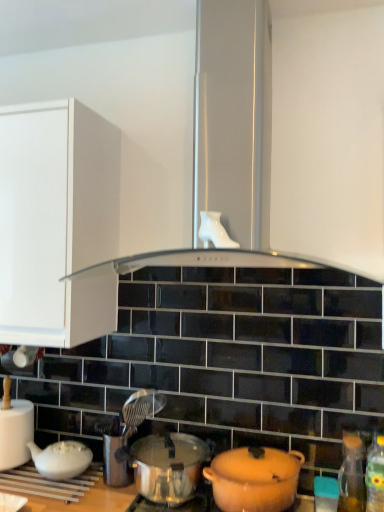
This screenshot has width=384, height=512. I want to click on black glass exhaust hood at center, so click(329, 138).

Where is `white matte teapot at lower left`? white matte teapot at lower left is located at coordinates (15, 433).

Where is `transparent glass bottle at lower right, which is counted as the first bottle, starting from the back`? transparent glass bottle at lower right, which is counted as the first bottle, starting from the back is located at coordinates (351, 476).

Find the location of a particular element. Image resolution: width=384 pixels, height=512 pixels. teal plastic container at lower right is located at coordinates (326, 494).

Identify the location of bottle beneath the green plastic bottle at lower right, which is the first bottle in front-to-back order (from a real-world perspective). The image size is (384, 512). (351, 476).

In the scene shown: Is transparent glass bottle at lower right, which ranks as the 2th bottle in front-to-back order, positioned in front of green plastic bottle at lower right, which is the first bottle in front-to-back order?

No, transparent glass bottle at lower right, which ranks as the 2th bottle in front-to-back order, is further to the viewer.

Can you confirm if transparent glass bottle at lower right, which is counted as the first bottle, starting from the back, is smaller than green plastic bottle at lower right, the second bottle positioned from the back?

Yes, transparent glass bottle at lower right, which is counted as the first bottle, starting from the back, is smaller than green plastic bottle at lower right, the second bottle positioned from the back.

From a real-world perspective, relative to teal plastic container at lower right, is matte orange pot at lower center, positioned as the 2th pot/pan in left-to-right order, vertically above or below?

matte orange pot at lower center, positioned as the 2th pot/pan in left-to-right order, is above teal plastic container at lower right.

Could you tell me if matte orange pot at lower center, positioned as the 2th pot/pan in left-to-right order, is turned towards teal plastic container at lower right?

No, matte orange pot at lower center, positioned as the 2th pot/pan in left-to-right order, is not oriented towards teal plastic container at lower right.

Between point (245, 452) and point (317, 494), which one is positioned in front?

Point (317, 494)

Starting from the teal plastic container at lower right, which pot/pan is the 2nd one in front? Please provide its 2D coordinates.

[(254, 479)]

Locate an element on the screen. The width and height of the screenshot is (384, 512). exhaust hood on the left of teal plastic container at lower right is located at coordinates (329, 138).

Is black glass exhaust hood at center in front of teal plastic container at lower right?

Yes, it is in front of teal plastic container at lower right.

How many degrees apart are the facing directions of black glass exhaust hood at center and teal plastic container at lower right?

2.85 degrees separate the facing orientations of black glass exhaust hood at center and teal plastic container at lower right.

How distant is green plastic bottle at lower right, the second bottle positioned from the back, from white matte teapot at lower left?

The distance of green plastic bottle at lower right, the second bottle positioned from the back, from white matte teapot at lower left is 1.23 meters.

Would you say white matte teapot at lower left is part of green plastic bottle at lower right, which is the first bottle in front-to-back order,'s contents?

Actually, white matte teapot at lower left is outside green plastic bottle at lower right, which is the first bottle in front-to-back order.

Are green plastic bottle at lower right, the second bottle positioned from the back, and white matte teapot at lower left making contact?

green plastic bottle at lower right, the second bottle positioned from the back, is not next to white matte teapot at lower left, and they're not touching.

Based on their sizes in the image, would you say green plastic bottle at lower right, the second bottle positioned from the back, is bigger or smaller than white matte teapot at lower left?

green plastic bottle at lower right, the second bottle positioned from the back, is smaller than white matte teapot at lower left.

Does point (272, 465) lie in front of point (278, 237)?

Yes, it is.

From the picture: From the image's perspective, would you say matte orange pot at lower center, which appears as the first pot/pan when viewed from the right, is shown under black glass exhaust hood at center?

Yes, from the image's perspective, matte orange pot at lower center, which appears as the first pot/pan when viewed from the right, is beneath black glass exhaust hood at center.

Does matte orange pot at lower center, positioned as the 2th pot/pan in left-to-right order, appear on the left side of black glass exhaust hood at center?

No, matte orange pot at lower center, positioned as the 2th pot/pan in left-to-right order, is not to the left of black glass exhaust hood at center.

Is matte orange pot at lower center, which appears as the first pot/pan when viewed from the right, located outside black glass exhaust hood at center?

That's correct, matte orange pot at lower center, which appears as the first pot/pan when viewed from the right, is outside of black glass exhaust hood at center.

From a real-world perspective, which object rests below the other?

In real-world perspective, white matte teapot at lower left is lower.

From the image's perspective, between white matte teapot at lower left and black glass exhaust hood at center, who is located below?

white matte teapot at lower left, from the image's perspective.

You are a GUI agent. You are given a task and a screenshot of the screen. Output one action in this format:
    pyautogui.click(x=<x>, y=<y>)
    Task: Click on the exhaust hood above the white matte teapot at lower left (from the image's perspective)
    
    Given the screenshot: What is the action you would take?
    pyautogui.click(x=329, y=138)

Can you confirm if white matte teapot at lower left is positioned to the right of black glass exhaust hood at center?

No, white matte teapot at lower left is not to the right of black glass exhaust hood at center.

Can you confirm if black glass exhaust hood at center is smaller than white matte teapot at lower left?

No, black glass exhaust hood at center is not smaller than white matte teapot at lower left.

Is point (294, 33) farther from viewer compared to point (9, 461)?

No, (294, 33) is closer to viewer.

Where is `exhaust hood that is on the right side of white matte teapot at lower left`? exhaust hood that is on the right side of white matte teapot at lower left is located at coordinates (329, 138).

Is black glass exhaust hood at center positioned in front of white matte teapot at lower left?

Yes.

What are the coordinates of `bottle that appears in front of the transparent glass bottle at lower right, which is counted as the first bottle, starting from the back` in the screenshot? It's located at (375, 476).

This screenshot has height=512, width=384. What are the coordinates of `appliance that appears on the right of matte orange pot at lower center, which appears as the first pot/pan when viewed from the right` in the screenshot? It's located at (326, 494).

In the scene shown: When comparing their distances from matte orange pot at lower center, which appears as the first pot/pan when viewed from the right, does transparent glass bottle at lower right, which ranks as the 2th bottle in front-to-back order, or black glass exhaust hood at center seem further?

The object further to matte orange pot at lower center, which appears as the first pot/pan when viewed from the right, is black glass exhaust hood at center.

When comparing their distances from teal plastic container at lower right, does shiny silver pot at center, arranged as the 2th pot/pan when viewed from the right, or white matte teapot at lower left seem further?

Among the two, white matte teapot at lower left is located further to teal plastic container at lower right.

Based on their spatial positions, is green plastic bottle at lower right, the second bottle positioned from the back, or shiny silver pot at center, arranged as the 2th pot/pan when viewed from the right, closer to black glass exhaust hood at center?

green plastic bottle at lower right, the second bottle positioned from the back.

Estimate the real-world distances between objects in this image. Which object is closer to transparent glass bottle at lower right, which is counted as the first bottle, starting from the back, green plastic bottle at lower right, which is the first bottle in front-to-back order, or black glass exhaust hood at center?

Based on the image, green plastic bottle at lower right, which is the first bottle in front-to-back order, appears to be nearer to transparent glass bottle at lower right, which is counted as the first bottle, starting from the back.

Looking at the image, which one is located further to shiny silver pot at center, arranged as the first pot/pan when viewed from the left, green plastic bottle at lower right, which is the first bottle in front-to-back order, or transparent glass bottle at lower right, which ranks as the 2th bottle in front-to-back order?

green plastic bottle at lower right, which is the first bottle in front-to-back order, is positioned further to the anchor shiny silver pot at center, arranged as the first pot/pan when viewed from the left.

From the image, which object appears to be farther from transparent glass bottle at lower right, which is counted as the first bottle, starting from the back, teal plastic container at lower right or matte orange pot at lower center, positioned as the 2th pot/pan in left-to-right order?

Among the two, matte orange pot at lower center, positioned as the 2th pot/pan in left-to-right order, is located further to transparent glass bottle at lower right, which is counted as the first bottle, starting from the back.

Considering their positions, is transparent glass bottle at lower right, which is counted as the first bottle, starting from the back, positioned further to teal plastic container at lower right than matte orange pot at lower center, which appears as the first pot/pan when viewed from the right?

matte orange pot at lower center, which appears as the first pot/pan when viewed from the right, lies further to teal plastic container at lower right than the other object.

Estimate the real-world distances between objects in this image. Which object is closer to black glass exhaust hood at center, shiny silver pot at center, arranged as the first pot/pan when viewed from the left, or teal plastic container at lower right?

Based on the image, shiny silver pot at center, arranged as the first pot/pan when viewed from the left, appears to be nearer to black glass exhaust hood at center.

You are a GUI agent. You are given a task and a screenshot of the screen. Output one action in this format:
    pyautogui.click(x=<x>, y=<y>)
    Task: Click on the bottle situated between shiny silver pot at center, arranged as the first pot/pan when viewed from the left, and green plastic bottle at lower right, the second bottle positioned from the back, from left to right
    This screenshot has width=384, height=512.
    Given the screenshot: What is the action you would take?
    pyautogui.click(x=351, y=476)

You are a GUI agent. You are given a task and a screenshot of the screen. Output one action in this format:
    pyautogui.click(x=<x>, y=<y>)
    Task: Click on the pot/pan between black glass exhaust hood at center and shiny silver pot at center, arranged as the 2th pot/pan when viewed from the right, vertically
    The height and width of the screenshot is (512, 384).
    Given the screenshot: What is the action you would take?
    pyautogui.click(x=254, y=479)

I want to click on bottle between black glass exhaust hood at center and matte orange pot at lower center, which appears as the first pot/pan when viewed from the right, in the vertical direction, so click(375, 476).

Image resolution: width=384 pixels, height=512 pixels. Identify the location of bottle between teal plastic container at lower right and green plastic bottle at lower right, the second bottle positioned from the back, in the horizontal direction. (351, 476).